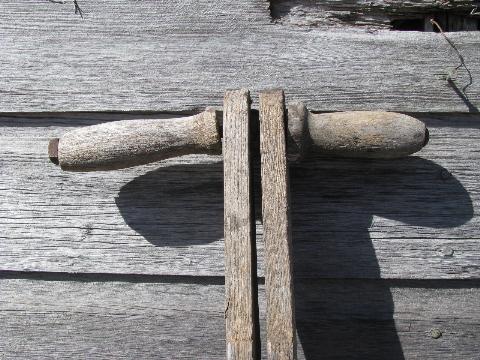
What are the coordinates of `handle` in the screenshot? It's located at (157, 127), (358, 130).